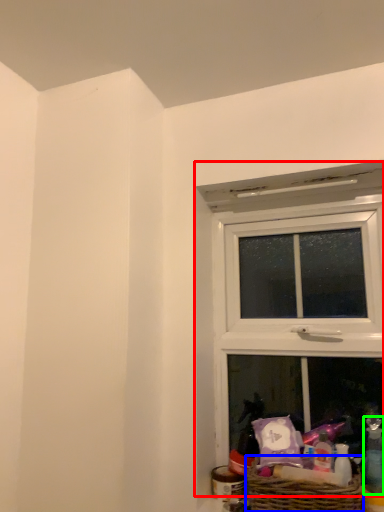
Question: Which is nearer to the window (highlighted by a red box)? picnic basket (highlighted by a blue box) or toiletry (highlighted by a green box).

Choices:
 (A) picnic basket
 (B) toiletry

Answer: (A)